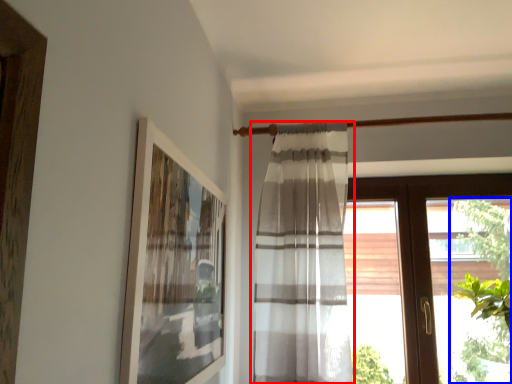
Question: Which point is further to the camera, curtain (highlighted by a red box) or plant (highlighted by a blue box)?

Choices:
 (A) curtain
 (B) plant

Answer: (A)